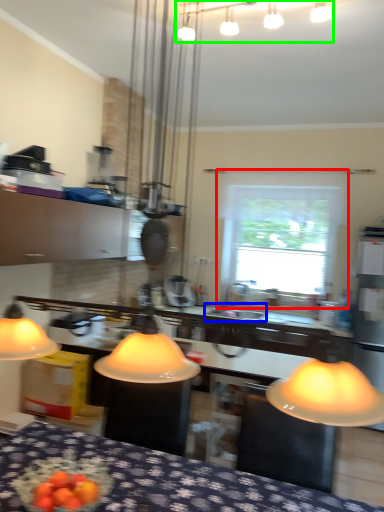
Question: Which object is the closest to the window (highlighted by a red box)? Choose among these: sink (highlighted by a blue box) or lamp (highlighted by a green box).

Choices:
 (A) sink
 (B) lamp

Answer: (B)